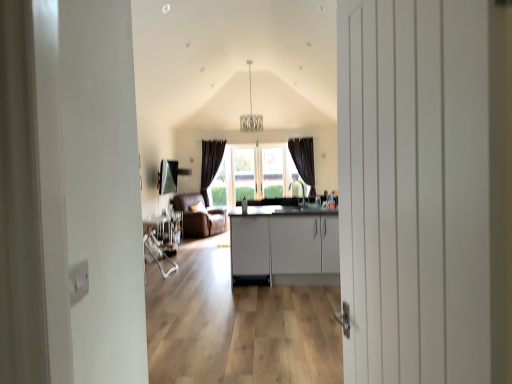
Question: Is metallic silver table at center oriented towards brown leather armchair at center?

Choices:
 (A) yes
 (B) no

Answer: (B)

Question: From the image's perspective, is metallic silver table at center over brown leather armchair at center?

Choices:
 (A) no
 (B) yes

Answer: (A)

Question: Is metallic silver table at center further to camera compared to brown leather armchair at center?

Choices:
 (A) yes
 (B) no

Answer: (B)

Question: Can you confirm if metallic silver table at center is thinner than brown leather armchair at center?

Choices:
 (A) no
 (B) yes

Answer: (B)

Question: Is metallic silver table at center next to brown leather armchair at center?

Choices:
 (A) yes
 (B) no

Answer: (B)

Question: Considering the relative sizes of metallic silver table at center and brown leather armchair at center in the image provided, is metallic silver table at center smaller than brown leather armchair at center?

Choices:
 (A) yes
 (B) no

Answer: (A)

Question: Considering the relative sizes of brown leather armchair at center and white matte cabinet at center in the image provided, is brown leather armchair at center smaller than white matte cabinet at center?

Choices:
 (A) yes
 (B) no

Answer: (A)

Question: From the image's perspective, does brown leather armchair at center appear lower than white matte cabinet at center?

Choices:
 (A) yes
 (B) no

Answer: (B)

Question: Considering the relative sizes of brown leather armchair at center and white matte cabinet at center in the image provided, is brown leather armchair at center taller than white matte cabinet at center?

Choices:
 (A) yes
 (B) no

Answer: (A)

Question: Can you confirm if brown leather armchair at center is thinner than white matte cabinet at center?

Choices:
 (A) yes
 (B) no

Answer: (A)

Question: Is brown leather armchair at center facing towards white matte cabinet at center?

Choices:
 (A) no
 (B) yes

Answer: (A)

Question: Is brown leather armchair at center oriented away from white matte cabinet at center?

Choices:
 (A) no
 (B) yes

Answer: (A)

Question: Does metallic silver table at center turn towards white matte cabinet at center?

Choices:
 (A) yes
 (B) no

Answer: (B)